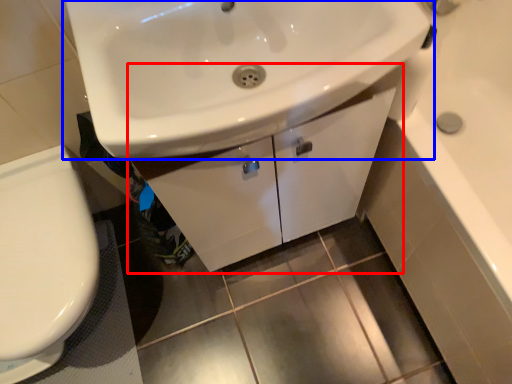
Question: Which of the following is the farthest to the observer, bathroom cabinet (highlighted by a red box) or sink (highlighted by a blue box)?

Choices:
 (A) bathroom cabinet
 (B) sink

Answer: (A)